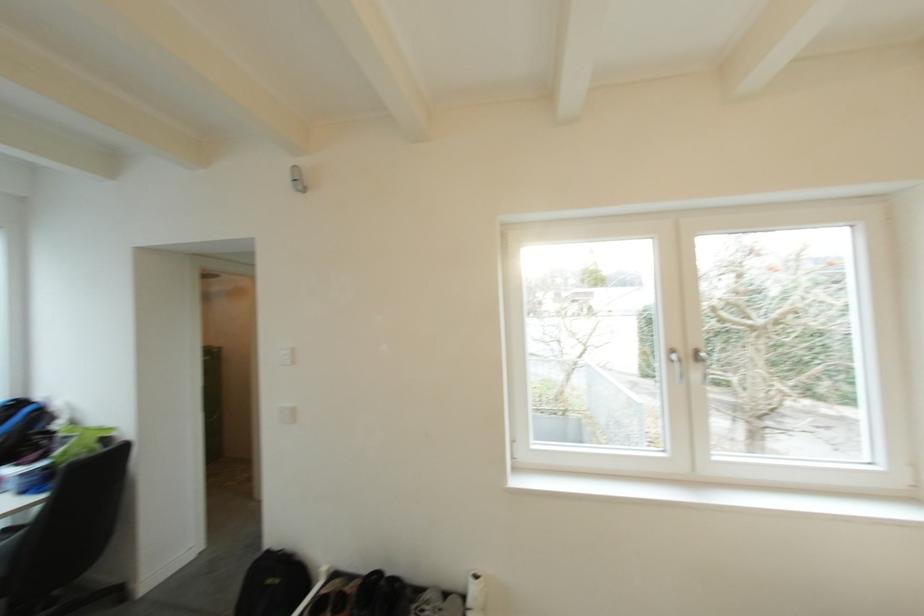
Locate an element on the screen. Image resolution: width=924 pixels, height=616 pixels. black backpack is located at coordinates (273, 584).